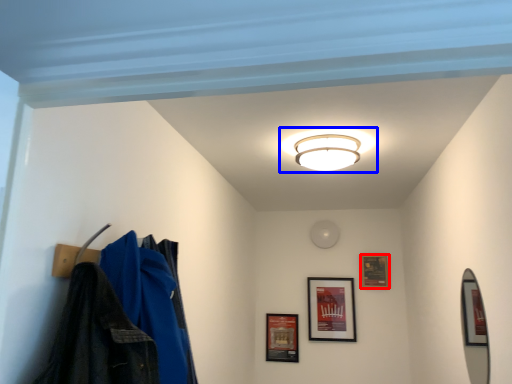
Question: Which point is closer to the camera, picture frame (highlighted by a red box) or lamp (highlighted by a blue box)?

Choices:
 (A) picture frame
 (B) lamp

Answer: (B)